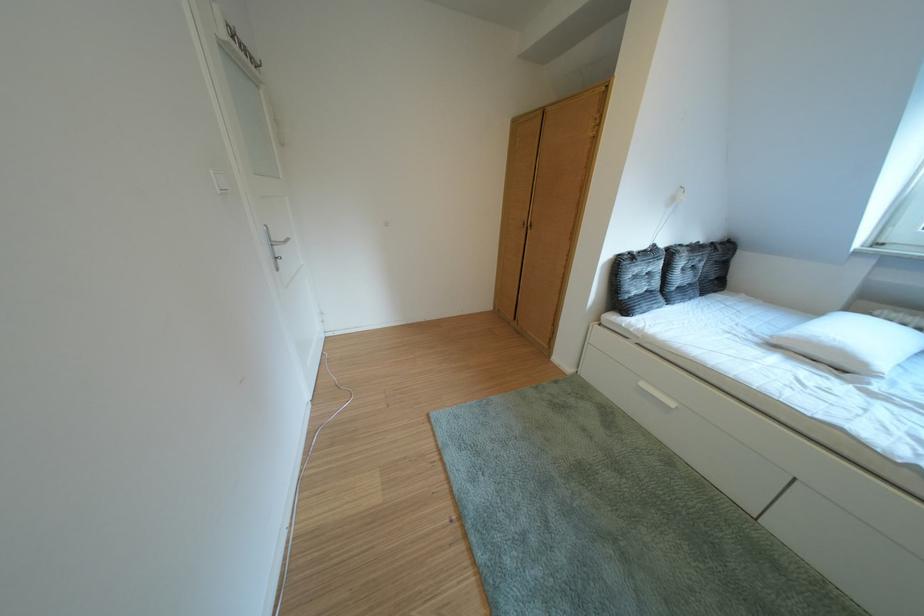
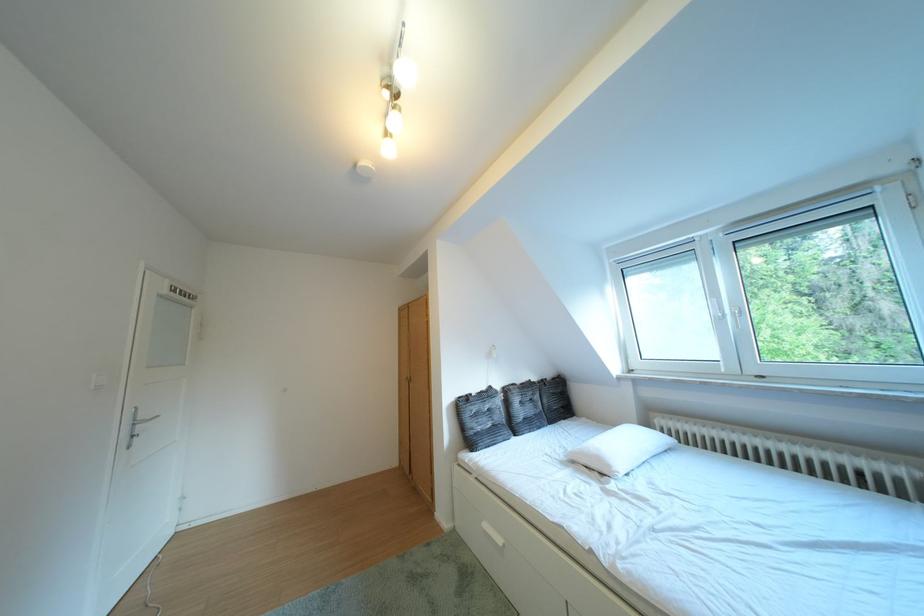
Question: The first image is from the beginning of the video and the second image is from the end. How did the camera likely rotate when shooting the video?

Choices:
 (A) Left
 (B) Right
 (C) Up
 (D) Down

Answer: (C)